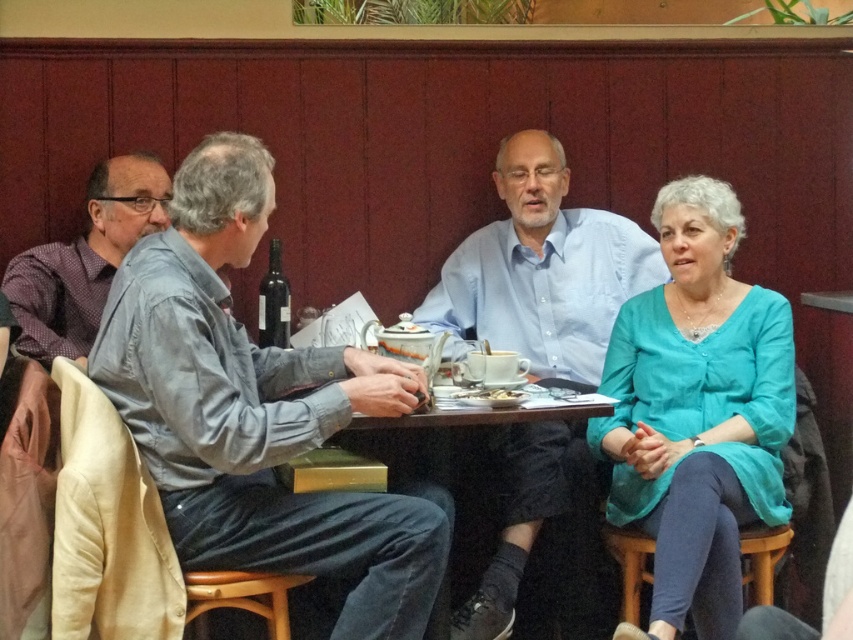
Can you confirm if gray cotton shirt at left is positioned to the right of plaid shirt at left?

Yes, gray cotton shirt at left is to the right of plaid shirt at left.

Identify the location of gray cotton shirt at left. The height and width of the screenshot is (640, 853). (258, 412).

Is point (178, 470) less distant than point (64, 291)?

Yes.

The image size is (853, 640). I want to click on gray cotton shirt at left, so click(258, 412).

Is point (193, 332) positioned in front of point (543, 220)?

That is True.

Identify the location of gray cotton shirt at left. The width and height of the screenshot is (853, 640). (258, 412).

The height and width of the screenshot is (640, 853). I want to click on gray cotton shirt at left, so click(x=258, y=412).

Which is in front, point (131, 374) or point (721, 237)?

Point (131, 374)

The width and height of the screenshot is (853, 640). I want to click on gray cotton shirt at left, so click(x=258, y=412).